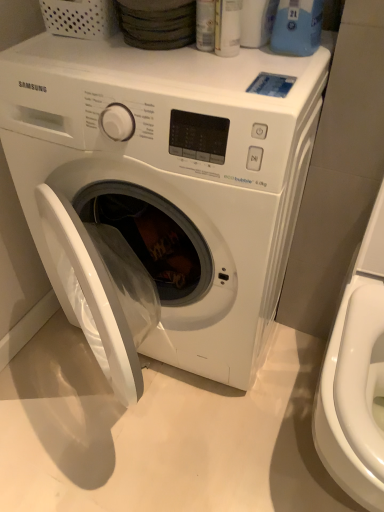
At what (x,y) coordinates should I click in order to perform the action: click on vacant area that is in front of blue plastic bottle at upper right. Please return your answer as a coordinate pair (x, y). Looking at the image, I should click on (278, 74).